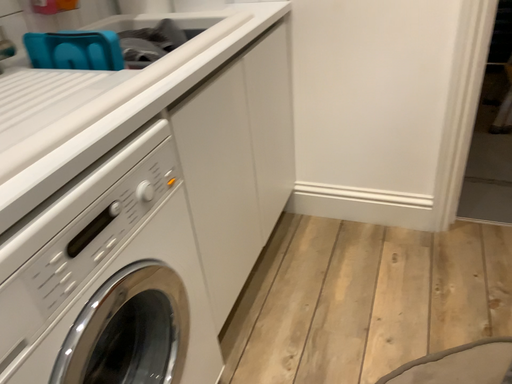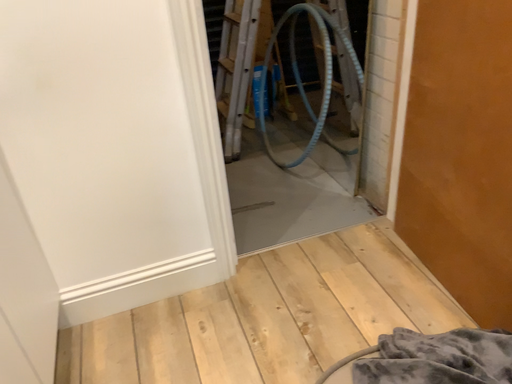
Question: How did the camera likely rotate when shooting the video?

Choices:
 (A) rotated left
 (B) rotated right

Answer: (B)